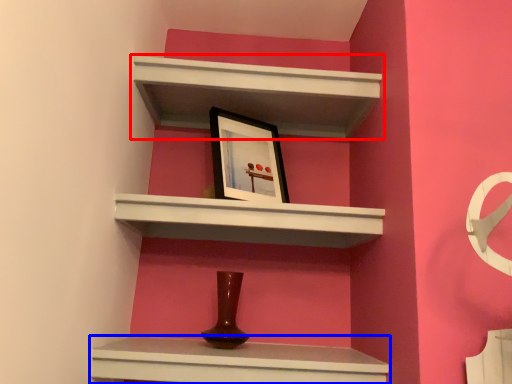
Question: Which of the following is the closest to the observer, shelf (highlighted by a red box) or shelf (highlighted by a blue box)?

Choices:
 (A) shelf
 (B) shelf

Answer: (B)